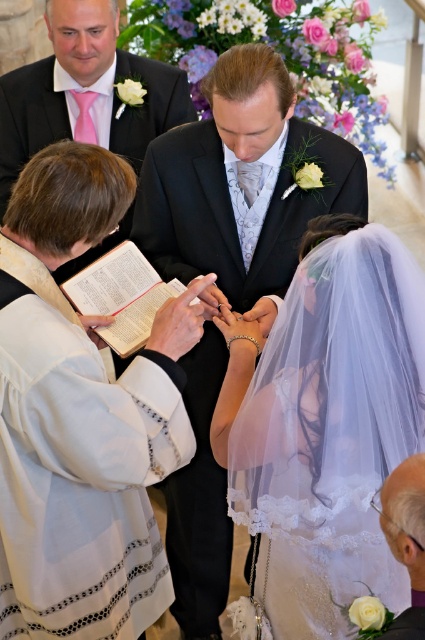
Which is below, black satin suit at center or matte pink tie at upper left?

black satin suit at center is lower down.

Is black satin suit at center wider than matte pink tie at upper left?

Incorrect, black satin suit at center's width does not surpass matte pink tie at upper left's.

This screenshot has width=425, height=640. In order to click on black satin suit at center in this screenshot , I will do `click(241, 186)`.

Can you confirm if black satin suit at center is shorter than hardcover book at center?

No.

Measure the distance between point (197, 488) and camera.

Point (197, 488) and camera are 8.38 feet apart from each other.

Which is behind, point (238, 212) or point (133, 349)?

The point (238, 212) is behind.

The width and height of the screenshot is (425, 640). What are the coordinates of `black satin suit at center` in the screenshot? It's located at (241, 186).

Is white lace veil at center shorter than hardcover book at center?

In fact, white lace veil at center may be taller than hardcover book at center.

Can you confirm if white lace veil at center is positioned below hardcover book at center?

Indeed, white lace veil at center is positioned under hardcover book at center.

Which is in front, point (274, 397) or point (110, 307)?

Positioned in front is point (274, 397).

At what (x,y) coordinates should I click in order to perform the action: click on white lace veil at center. Please return your answer as a coordinate pair (x, y). The width and height of the screenshot is (425, 640). Looking at the image, I should click on (325, 426).